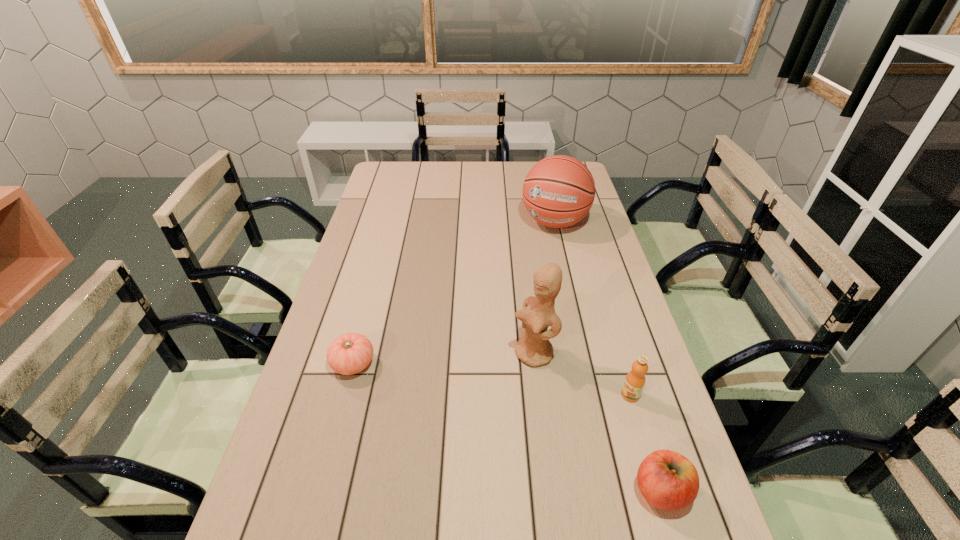
At what (x,y) coordinates should I click in order to perform the action: click on vacant space located on the front label of the third shortest object. Please return your answer as a coordinate pair (x, y). The height and width of the screenshot is (540, 960). Looking at the image, I should click on (603, 407).

Locate an element on the screen. This screenshot has height=540, width=960. vacant space located on the front label of the third shortest object is located at coordinates (491, 457).

The image size is (960, 540). I want to click on free point located 0.230m on the front label of the third shortest object, so click(x=544, y=433).

This screenshot has width=960, height=540. In order to click on free space located 0.190m on the front-facing side of the figurine in this screenshot , I will do `click(459, 399)`.

Identify the location of vacant region located 0.340m on the front-facing side of the figurine. This screenshot has height=540, width=960. (406, 431).

Locate an element on the screen. The height and width of the screenshot is (540, 960). vacant area situated on the front-facing side of the figurine is located at coordinates (402, 433).

I want to click on vacant space located 0.110m on the logo side of the basketball, so click(x=538, y=258).

This screenshot has width=960, height=540. Identify the location of free space located 0.350m on the logo side of the basketball. (516, 302).

Image resolution: width=960 pixels, height=540 pixels. I want to click on free point located on the logo side of the basketball, so click(536, 261).

Locate an element on the screen. object that is positioned at the near edge is located at coordinates (667, 480).